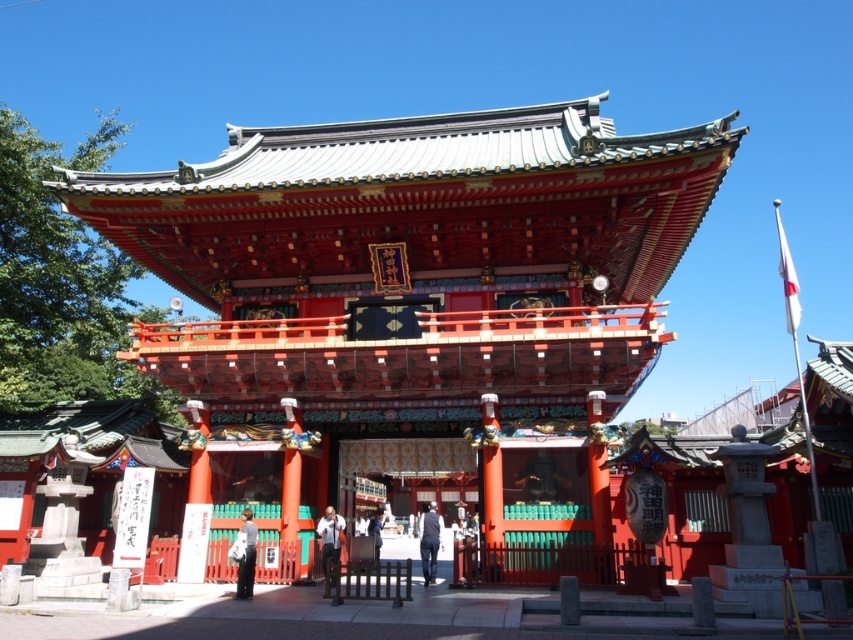
You are a visitor approaching the shrine and want to take a photo of the shiny lacquered shrine gate at center without the blue fabric at center appearing in the background. Is this possible based on their positions?

The shiny lacquered shrine gate at center is in front of the blue fabric at center, so taking a photo from the front would exclude the blue fabric at center from the background.